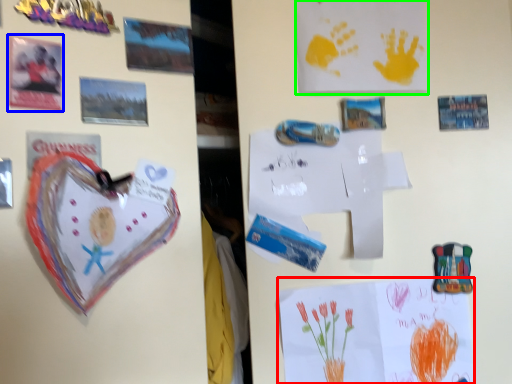
Question: Which is farther away from postcard (highlighted by a red box)? postcard (highlighted by a blue box) or postcard (highlighted by a green box)?

Choices:
 (A) postcard
 (B) postcard

Answer: (A)